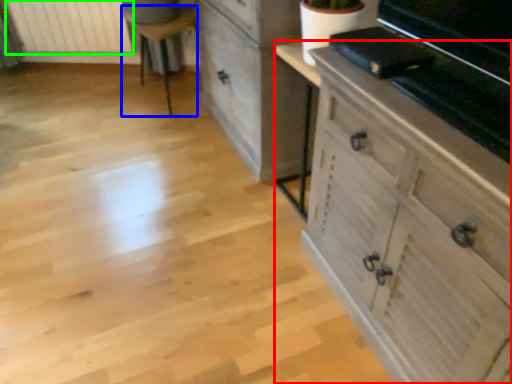
Question: Considering the real-world distances, which object is farthest from chest of drawers (highlighted by a red box)? furniture (highlighted by a blue box) or radiator (highlighted by a green box)?

Choices:
 (A) furniture
 (B) radiator

Answer: (B)